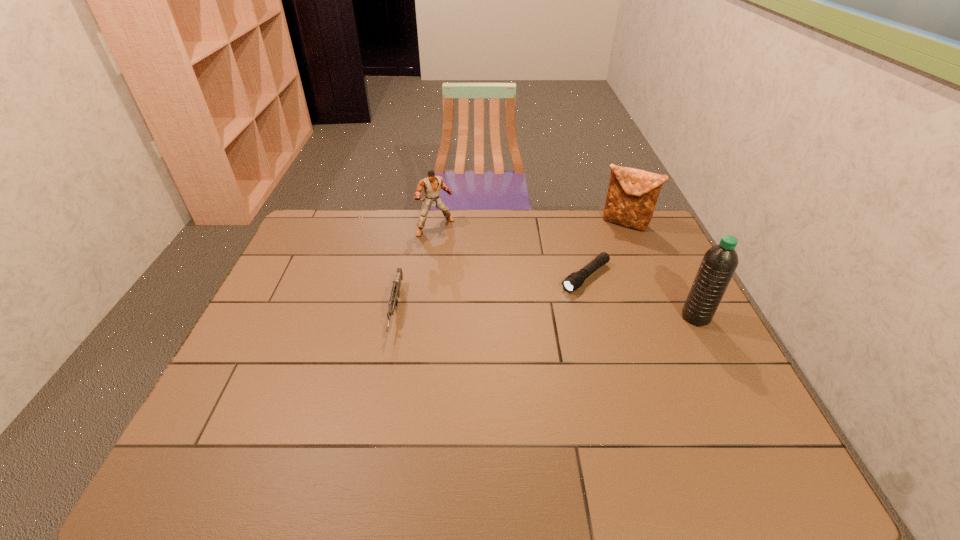
The width and height of the screenshot is (960, 540). What are the coordinates of `free space that satisfies the following two spatial constraints: 1. aimed along the barrel of the fourth tallest object; 2. on the left side of the tallest object` in the screenshot? It's located at (395, 317).

At what (x,y) coordinates should I click in order to perform the action: click on free space that satisfies the following two spatial constraints: 1. on the back side of the third object from left to right; 2. on the right side of the clutch bag. Please return your answer as a coordinate pair (x, y). Image resolution: width=960 pixels, height=540 pixels. Looking at the image, I should click on (570, 223).